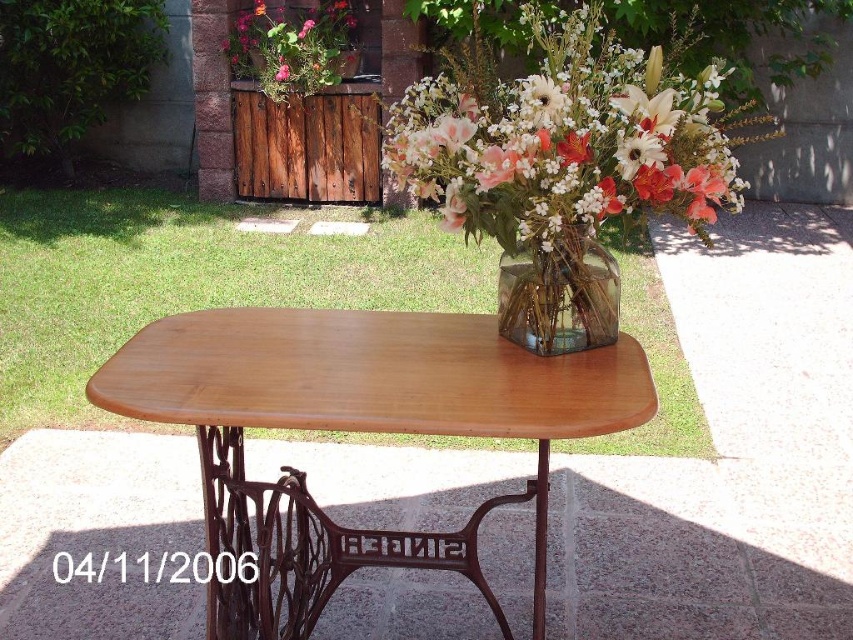
Question: Does light brown wood table at center come in front of translucent glass vase at center?

Choices:
 (A) yes
 (B) no

Answer: (A)

Question: Is transparent glass vase at center positioned behind matte plastic flowers at upper center?

Choices:
 (A) yes
 (B) no

Answer: (B)

Question: Estimate the real-world distances between objects in this image. Which object is farther from the translucent glass vase at center?

Choices:
 (A) transparent glass vase at center
 (B) matte plastic flowers at upper center

Answer: (B)

Question: Which point is farther from the camera taking this photo?

Choices:
 (A) (732, 196)
 (B) (535, 269)

Answer: (B)

Question: Can you confirm if light brown wood table at center is positioned below translucent glass vase at center?

Choices:
 (A) yes
 (B) no

Answer: (A)

Question: Which point is farther to the camera?

Choices:
 (A) tap(511, 244)
 (B) tap(326, 17)
 (C) tap(587, 310)

Answer: (B)